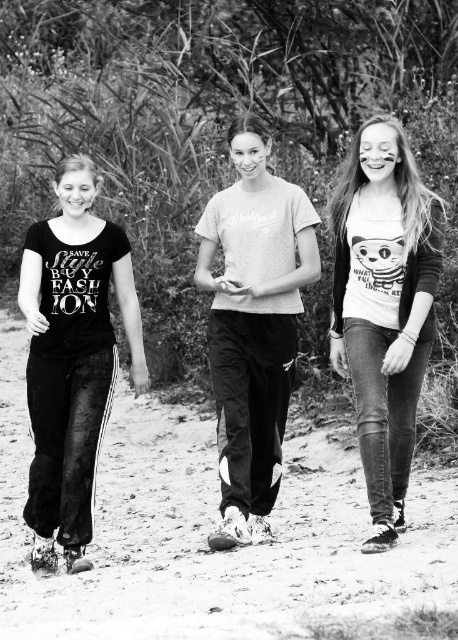
Who is more distant from viewer, (274, 353) or (398, 234)?

Positioned behind is point (274, 353).

Between point (198, 253) and point (408, 147), which one is positioned in front?

Point (408, 147) is in front.

Locate an element on the screen. light gray cotton t-shirt at center is located at coordinates (252, 324).

Which is more to the left, dirt track at center or white printed t-shirt at center?

dirt track at center

Can you confirm if dirt track at center is positioned above white printed t-shirt at center?

No, dirt track at center is not above white printed t-shirt at center.

Between point (213, 579) and point (409, 205), which one is positioned behind?

The point (409, 205) is more distant.

Find the location of a particular element. dirt track at center is located at coordinates (208, 531).

Consider the image. Between dirt track at center and black matte t-shirt at left, which one appears on the right side from the viewer's perspective?

dirt track at center is more to the right.

The width and height of the screenshot is (458, 640). What do you see at coordinates (208, 531) in the screenshot?
I see `dirt track at center` at bounding box center [208, 531].

Does point (10, 595) come farther from viewer compared to point (123, 269)?

No, (10, 595) is closer to viewer.

Where is `dirt track at center`? Image resolution: width=458 pixels, height=640 pixels. dirt track at center is located at coordinates (208, 531).